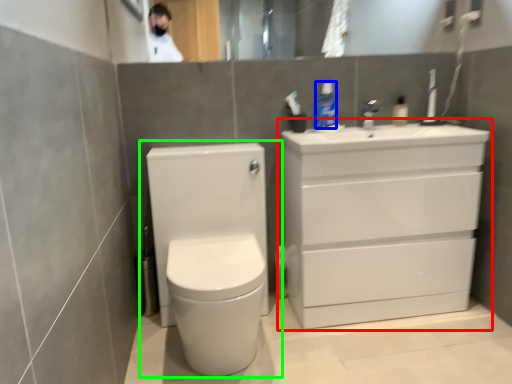
Question: Based on their relative distances, which object is nearer to bathroom cabinet (highlighted by a red box)? Choose from toiletry (highlighted by a blue box) and toilet (highlighted by a green box).

Choices:
 (A) toiletry
 (B) toilet

Answer: (B)